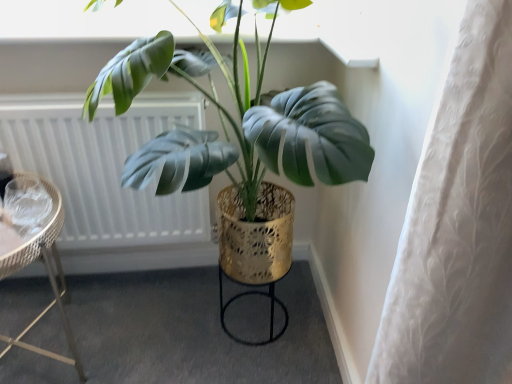
What do you see at coordinates (253, 294) in the screenshot? I see `gold textured stool at center` at bounding box center [253, 294].

The height and width of the screenshot is (384, 512). What do you see at coordinates (234, 119) in the screenshot?
I see `shiny gold pot at center` at bounding box center [234, 119].

This screenshot has height=384, width=512. Find the location of `white textured radiator at upper left`. white textured radiator at upper left is located at coordinates (104, 166).

Find the location of a particular element. The image size is (512, 384). gold textured stool at center is located at coordinates (253, 294).

Is gold textured stool at center to the left of metallic wicker side table at left from the viewer's perspective?

No.

Between point (282, 304) and point (54, 290), which one is positioned behind?

Positioned behind is point (282, 304).

In terms of size, does gold textured stool at center appear bigger or smaller than metallic wicker side table at left?

Considering their sizes, gold textured stool at center takes up less space than metallic wicker side table at left.

Is metallic wicker side table at left inside or outside of white textured radiator at upper left?

metallic wicker side table at left is not inside white textured radiator at upper left, it's outside.

Is metallic wicker side table at left facing away from white textured radiator at upper left?

Yes, white textured radiator at upper left is at the back of metallic wicker side table at left.

From the picture: From the image's perspective, which is below, metallic wicker side table at left or white textured radiator at upper left?

metallic wicker side table at left, from the image's perspective.

In the scene shown: Considering the positions of objects metallic wicker side table at left and shiny gold pot at center in the image provided, who is behind, metallic wicker side table at left or shiny gold pot at center?

metallic wicker side table at left is behind.

Which is more distant, [58,303] or [367,164]?

The point [58,303] is farther from the camera.

Between metallic wicker side table at left and shiny gold pot at center, which one appears on the left side from the viewer's perspective?

Positioned to the left is metallic wicker side table at left.

Considering the relative sizes of metallic wicker side table at left and shiny gold pot at center in the image provided, is metallic wicker side table at left taller than shiny gold pot at center?

No, metallic wicker side table at left is not taller than shiny gold pot at center.

From a real-world perspective, is metallic wicker side table at left below gold textured stool at center?

No.

Considering the sizes of objects metallic wicker side table at left and gold textured stool at center in the image provided, who is thinner, metallic wicker side table at left or gold textured stool at center?

gold textured stool at center.

Consider the image. Which point is more forward, (28, 254) or (244, 295)?

The point (28, 254) is in front.

Could you tell me if metallic wicker side table at left is turned towards gold textured stool at center?

No, metallic wicker side table at left is not aimed at gold textured stool at center.

Considering the positions of objects shiny gold pot at center and white textured radiator at upper left in the image provided, who is more to the right, shiny gold pot at center or white textured radiator at upper left?

Positioned to the right is shiny gold pot at center.

Can you confirm if shiny gold pot at center is smaller than white textured radiator at upper left?

Actually, shiny gold pot at center might be larger than white textured radiator at upper left.

Do you think shiny gold pot at center is within white textured radiator at upper left, or outside of it?

shiny gold pot at center lies outside white textured radiator at upper left.

How many degrees apart are the facing directions of shiny gold pot at center and white textured radiator at upper left?

shiny gold pot at center and white textured radiator at upper left are facing 0.257 degrees away from each other.

Consider the image. From the image's perspective, which object appears higher, gold textured stool at center or shiny gold pot at center?

shiny gold pot at center is shown above in the image.

Considering the sizes of objects gold textured stool at center and shiny gold pot at center in the image provided, who is bigger, gold textured stool at center or shiny gold pot at center?

Bigger between the two is shiny gold pot at center.

Which object is closer to the camera, gold textured stool at center or shiny gold pot at center?

shiny gold pot at center.

Is gold textured stool at center shorter than shiny gold pot at center?

Correct, gold textured stool at center is not as tall as shiny gold pot at center.

From the image's perspective, which object appears higher, white textured radiator at upper left or gold textured stool at center?

white textured radiator at upper left.

How distant is white textured radiator at upper left from gold textured stool at center?

They are 18.23 inches apart.

Considering the relative sizes of white textured radiator at upper left and gold textured stool at center in the image provided, is white textured radiator at upper left bigger than gold textured stool at center?

Indeed, white textured radiator at upper left has a larger size compared to gold textured stool at center.

Consider the image. Considering the sizes of objects white textured radiator at upper left and gold textured stool at center in the image provided, who is wider, white textured radiator at upper left or gold textured stool at center?

With larger width is gold textured stool at center.

You are a GUI agent. You are given a task and a screenshot of the screen. Output one action in this format:
    pyautogui.click(x=<x>, y=<y>)
    Task: Click on the furniture that is above the gold textured stool at center (from the image's perspective)
    
    Given the screenshot: What is the action you would take?
    [47, 273]

Image resolution: width=512 pixels, height=384 pixels. Identify the location of radiator that appears on the right of metallic wicker side table at left. (104, 166).

From the image, which object appears to be nearer to gold textured stool at center, white textured radiator at upper left or shiny gold pot at center?

Based on the image, white textured radiator at upper left appears to be nearer to gold textured stool at center.

Looking at the image, which one is located closer to shiny gold pot at center, white textured radiator at upper left or gold textured stool at center?

Among the two, white textured radiator at upper left is located nearer to shiny gold pot at center.

Based on their spatial positions, is white textured radiator at upper left or metallic wicker side table at left further from shiny gold pot at center?

Result: metallic wicker side table at left is further to shiny gold pot at center.

When comparing their distances from gold textured stool at center, does shiny gold pot at center or metallic wicker side table at left seem further?

shiny gold pot at center is positioned further to the anchor gold textured stool at center.

Looking at the image, which one is located further to white textured radiator at upper left, metallic wicker side table at left or shiny gold pot at center?

Based on the image, metallic wicker side table at left appears to be further to white textured radiator at upper left.

Looking at the image, which one is located closer to gold textured stool at center, shiny gold pot at center or white textured radiator at upper left?

white textured radiator at upper left.

Which object lies further to the anchor point shiny gold pot at center, gold textured stool at center or metallic wicker side table at left?

gold textured stool at center.

From the image, which object appears to be nearer to shiny gold pot at center, metallic wicker side table at left or gold textured stool at center?

Among the two, metallic wicker side table at left is located nearer to shiny gold pot at center.

You are a GUI agent. You are given a task and a screenshot of the screen. Output one action in this format:
    pyautogui.click(x=<x>, y=<y>)
    Task: Click on the houseplant located between metallic wicker side table at left and gold textured stool at center in the left-right direction
    The height and width of the screenshot is (384, 512).
    Given the screenshot: What is the action you would take?
    click(234, 119)

At what (x,y) coordinates should I click in order to perform the action: click on radiator between metallic wicker side table at left and shiny gold pot at center from left to right. Please return your answer as a coordinate pair (x, y). Image resolution: width=512 pixels, height=384 pixels. Looking at the image, I should click on (104, 166).

Identify the location of radiator between shiny gold pot at center and gold textured stool at center along the z-axis. (104, 166).

Where is `radiator between metallic wicker side table at left and gold textured stool at center`? This screenshot has width=512, height=384. radiator between metallic wicker side table at left and gold textured stool at center is located at coordinates (104, 166).